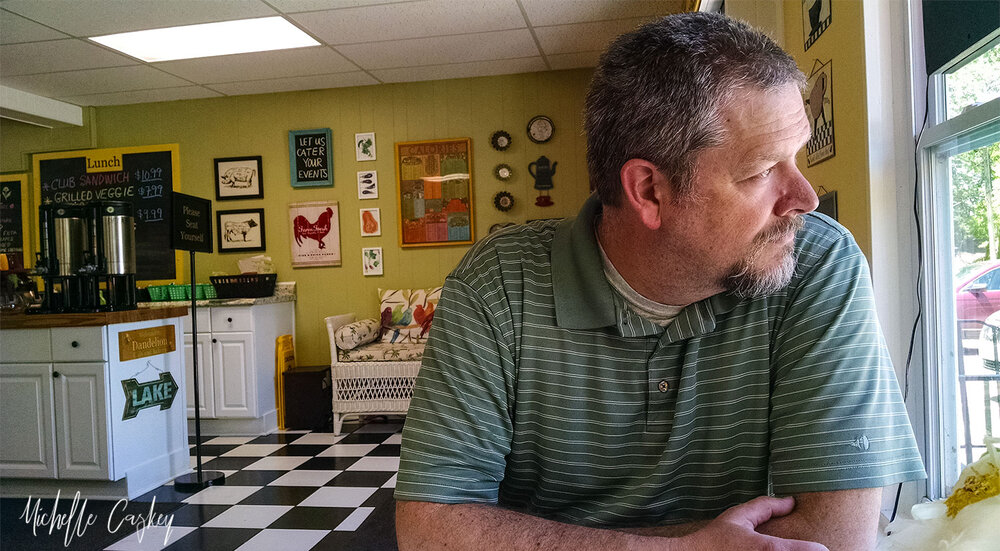
Locate an element on the screen. This screenshot has height=551, width=1000. cabinets is located at coordinates (69, 412), (203, 372).